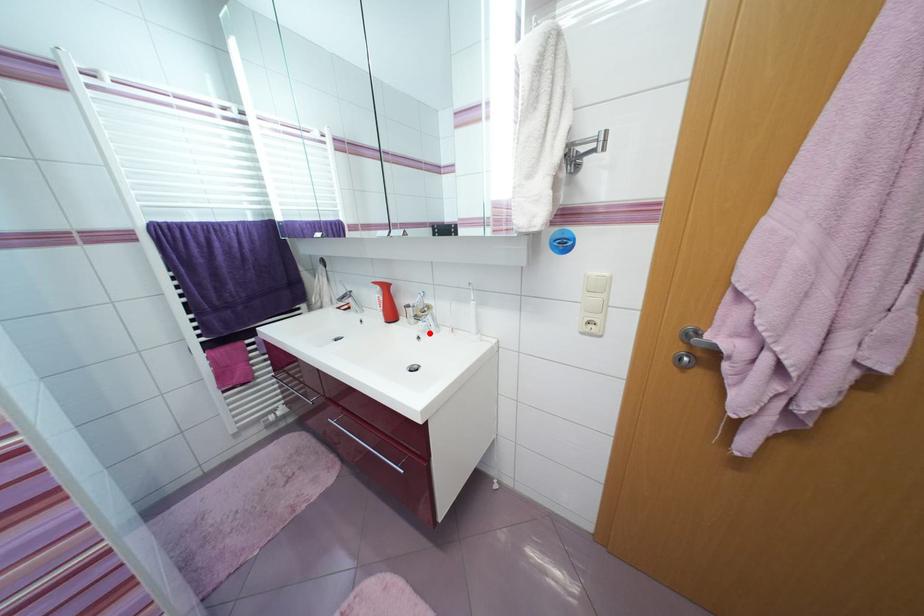
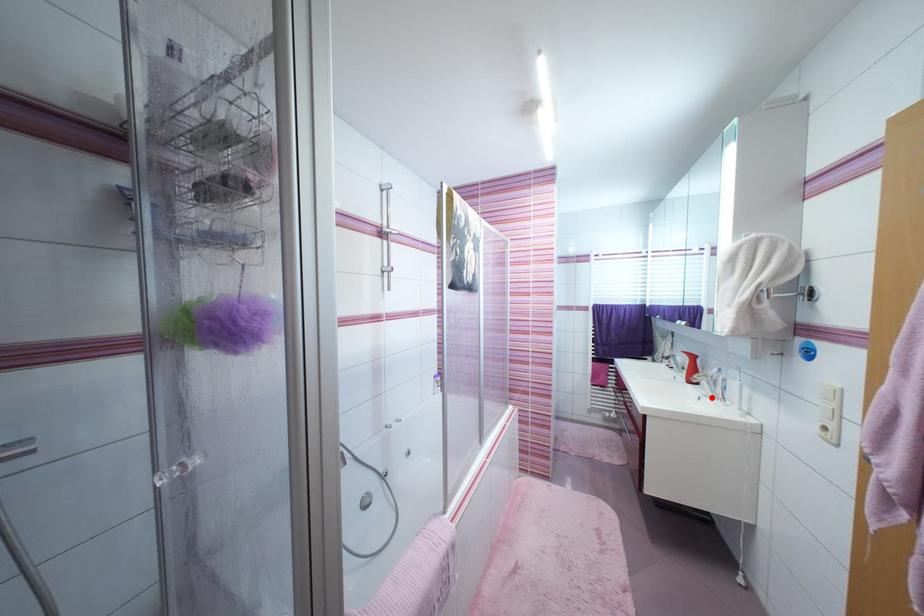
I am providing you with two images of the same scene from different viewpoints. A red point is marked on the first image and another point is marked on the second image. Do the highlighted points in image1 and image2 indicate the same real-world spot?

Yes